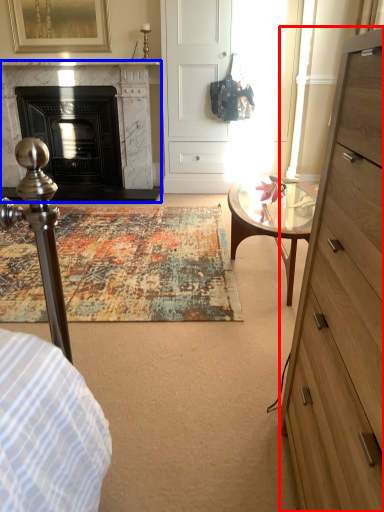
Question: Which of the following is the farthest to the observer, chest of drawers (highlighted by a red box) or fireplace (highlighted by a blue box)?

Choices:
 (A) chest of drawers
 (B) fireplace

Answer: (B)